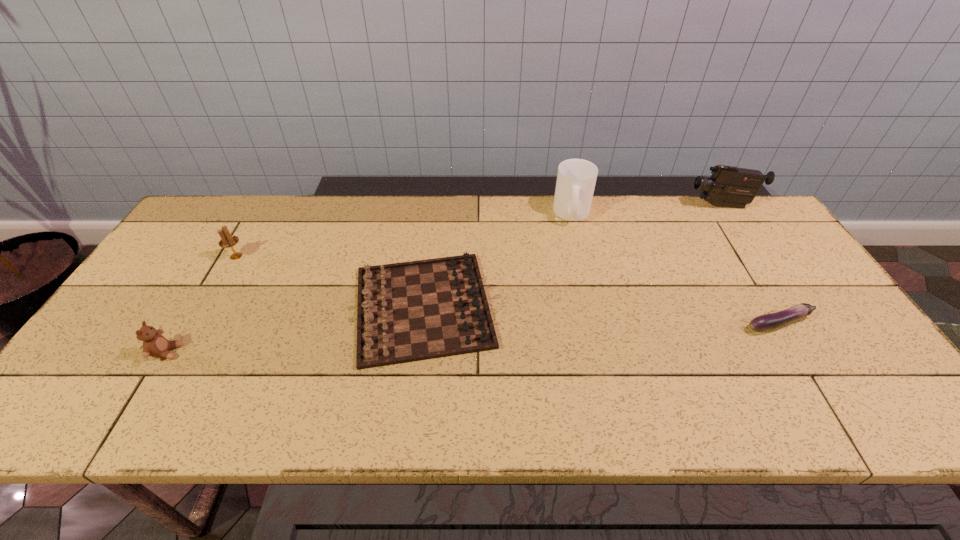
What are the coordinates of `mug` in the screenshot? It's located at (576, 179).

Image resolution: width=960 pixels, height=540 pixels. In order to click on camcorder in this screenshot , I will do `click(730, 186)`.

Where is `the fourth shortest object`? This screenshot has height=540, width=960. the fourth shortest object is located at coordinates (227, 241).

Locate an element on the screen. teddy bear is located at coordinates (154, 344).

Identify the location of the second shortest object. (410, 311).

At what (x,y) coordinates should I click in order to perform the action: click on chessboard. Please return your answer as a coordinate pair (x, y). Looking at the image, I should click on (410, 311).

Where is `eggplant`? This screenshot has height=540, width=960. eggplant is located at coordinates (770, 321).

At what (x,y) coordinates should I click in order to perform the action: click on free space located 0.300m on the handle side of the third object from right to left. Please return your answer as a coordinate pair (x, y). The image size is (960, 540). Looking at the image, I should click on (593, 301).

I want to click on vacant space located 0.230m on the front-facing side of the camcorder, so click(x=619, y=206).

Identify the location of free space located on the front-facing side of the camcorder. Image resolution: width=960 pixels, height=540 pixels. (570, 206).